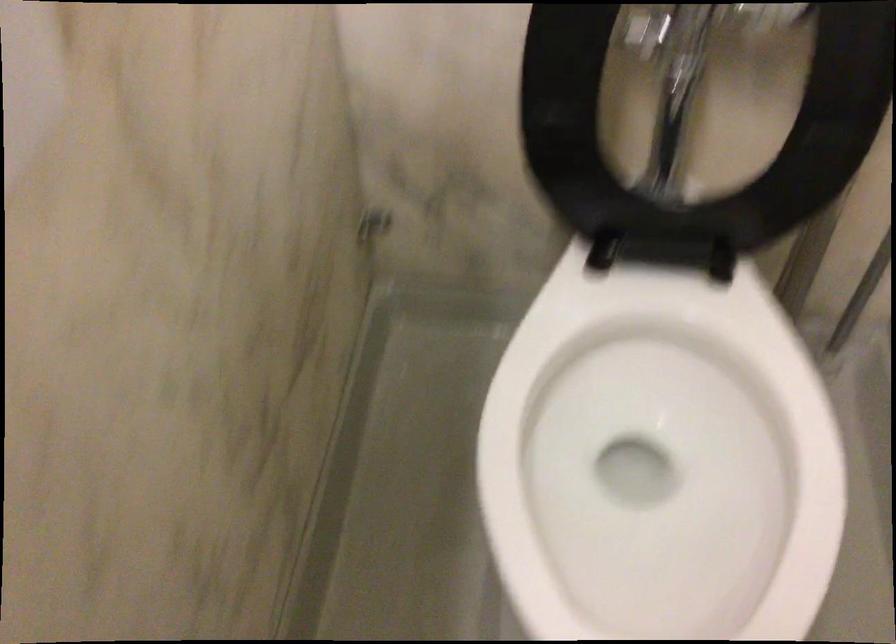
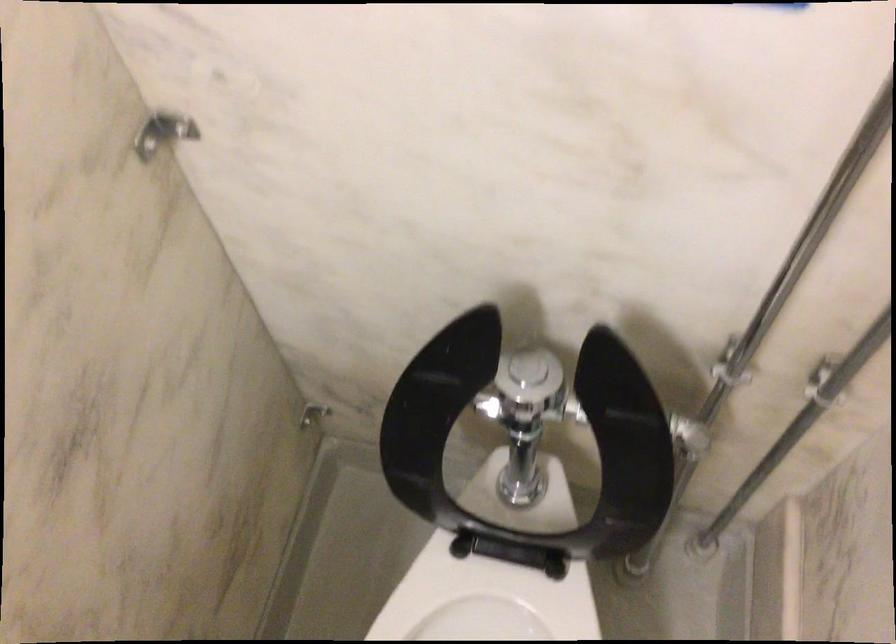
In the second image, find the point that corresponds to point 618,357 in the first image.

(487, 605)